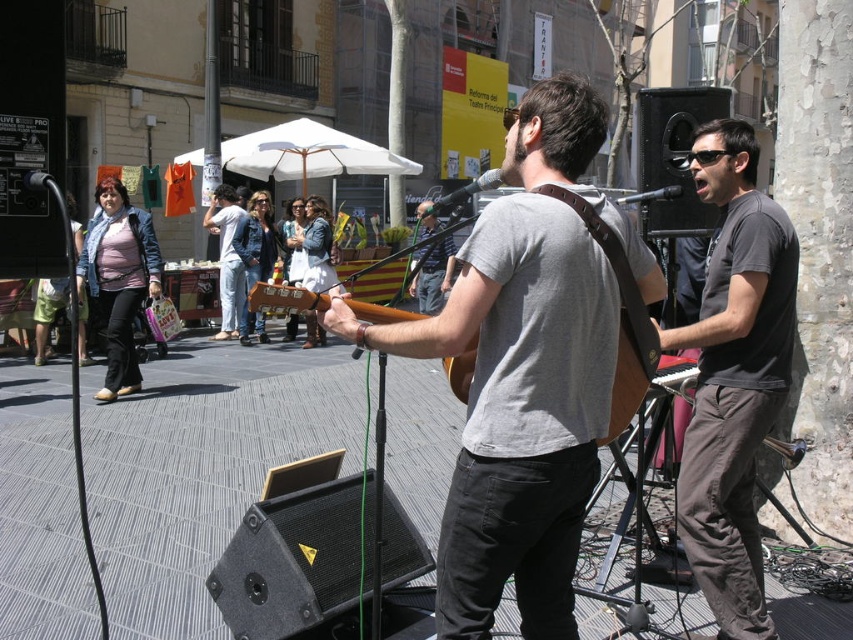
Between point (125, 314) and point (639, 196), which one is positioned in front?

Point (639, 196) is more forward.

Can you confirm if matte pink shirt at left is smaller than metallic silver microphone at upper right?

Actually, matte pink shirt at left might be larger than metallic silver microphone at upper right.

Which is in front, point (102, 260) or point (648, 193)?

Point (648, 193) is in front.

The image size is (853, 640). I want to click on matte pink shirt at left, so click(x=119, y=278).

Is matte brown guitar at center wider than dark gray t-shirt at center?

Incorrect, matte brown guitar at center's width does not surpass dark gray t-shirt at center's.

Is matte brown guitar at center smaller than dark gray t-shirt at center?

Yes, matte brown guitar at center is smaller than dark gray t-shirt at center.

Is point (548, 211) positioned before point (712, 513)?

Yes, it is in front of point (712, 513).

Find the location of a particular element. The width and height of the screenshot is (853, 640). matte brown guitar at center is located at coordinates (521, 376).

This screenshot has height=640, width=853. What do you see at coordinates (733, 376) in the screenshot? I see `dark gray t-shirt at center` at bounding box center [733, 376].

Find the location of a particular element. The image size is (853, 640). dark gray t-shirt at center is located at coordinates (733, 376).

What are the coordinates of `dark gray t-shirt at center` in the screenshot? It's located at (733, 376).